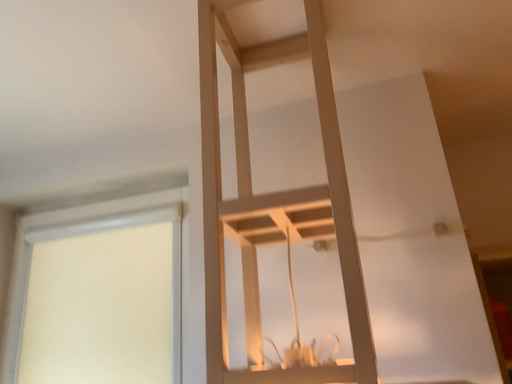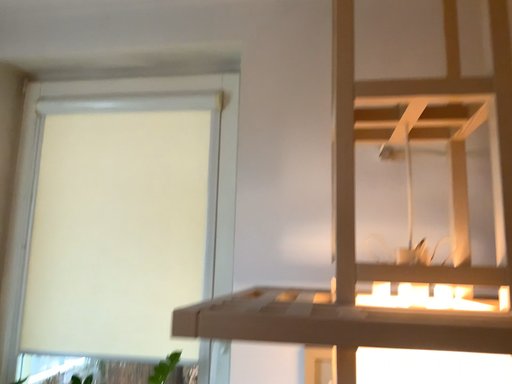
Question: Which way did the camera rotate in the video?

Choices:
 (A) rotated downward
 (B) rotated upward

Answer: (A)